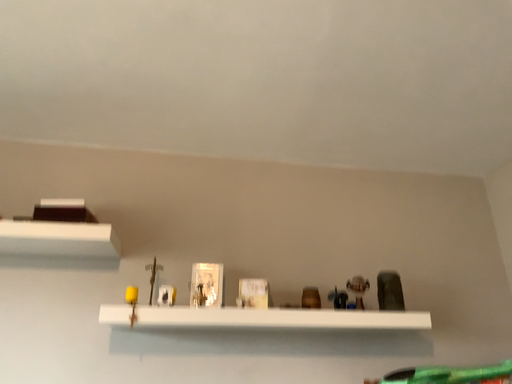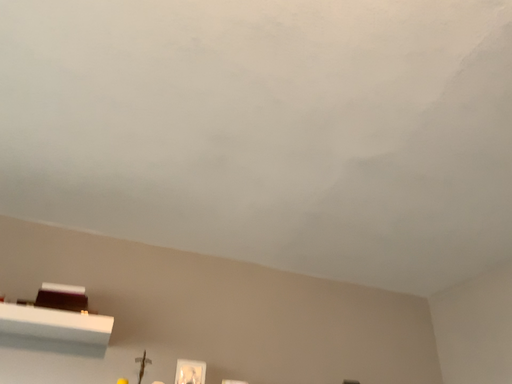
Question: How did the camera likely rotate when shooting the video?

Choices:
 (A) rotated downward
 (B) rotated upward

Answer: (B)